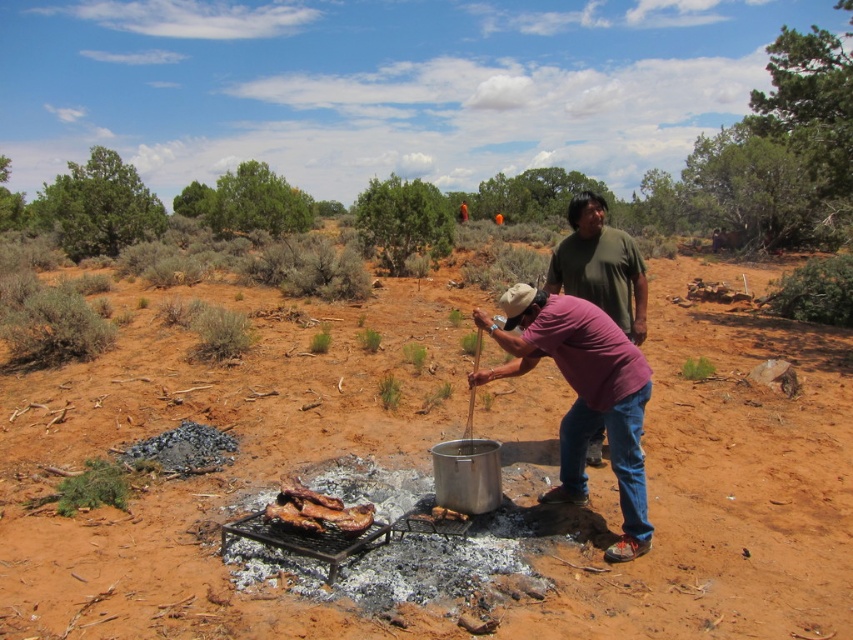
Question: Is dirt field at center bigger than purple cotton shirt at center?

Choices:
 (A) yes
 (B) no

Answer: (A)

Question: Is purple cotton shirt at center closer to the viewer compared to green matte shirt at center?

Choices:
 (A) yes
 (B) no

Answer: (A)

Question: Which of the following is the closest to the observer?

Choices:
 (A) (287, 502)
 (B) (757, 417)

Answer: (A)

Question: Which of the following is the closest to the observer?

Choices:
 (A) dirt field at center
 (B) purple cotton shirt at center

Answer: (A)

Question: Which point appears closest to the camera in this image?

Choices:
 (A) (538, 292)
 (B) (212, 595)
 (C) (581, 291)

Answer: (B)

Question: Can you confirm if purple cotton shirt at center is positioned above green matte shirt at center?

Choices:
 (A) yes
 (B) no

Answer: (B)